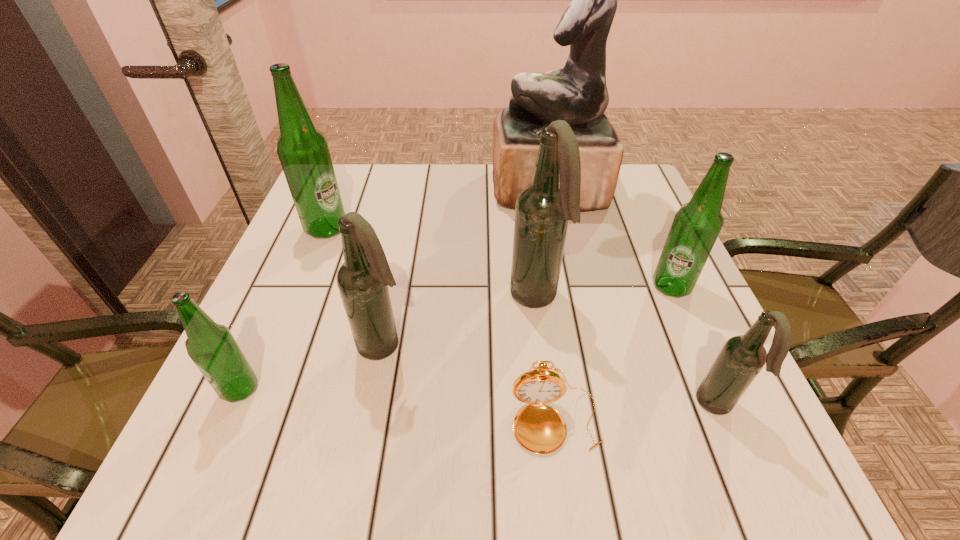
Identify the location of vacant space that satisfies the following two spatial constraints: 1. on the back side of the smallest dark beer bottle; 2. in a relaxed pose on the tallest object. (624, 190).

This screenshot has width=960, height=540. Identify the location of vacant point that satisfies the following two spatial constraints: 1. on the label of the biggest green beer bottle; 2. on the label of the smallest green beer bottle. (261, 389).

Where is `vacant area that satisfies the following two spatial constraints: 1. in a relaxed pose on the tallest object; 2. on the label of the nearest green beer bottle`? The width and height of the screenshot is (960, 540). vacant area that satisfies the following two spatial constraints: 1. in a relaxed pose on the tallest object; 2. on the label of the nearest green beer bottle is located at coordinates (588, 389).